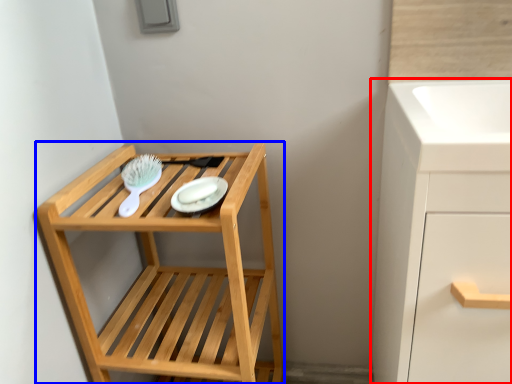
Question: Which object appears closest to the camera in this image, bathroom cabinet (highlighted by a red box) or furniture (highlighted by a blue box)?

Choices:
 (A) bathroom cabinet
 (B) furniture

Answer: (A)